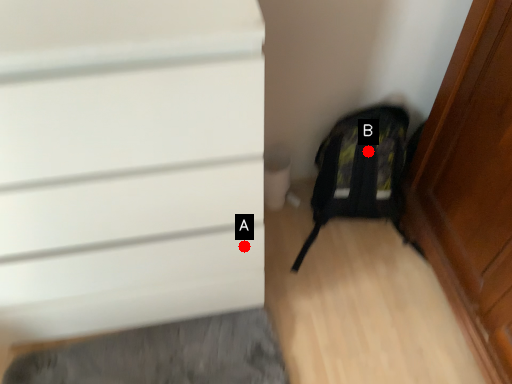
Question: Two points are circled on the image, labeled by A and B beside each circle. Which of the following is the farthest from the observer?

Choices:
 (A) A is further
 (B) B is further

Answer: (B)